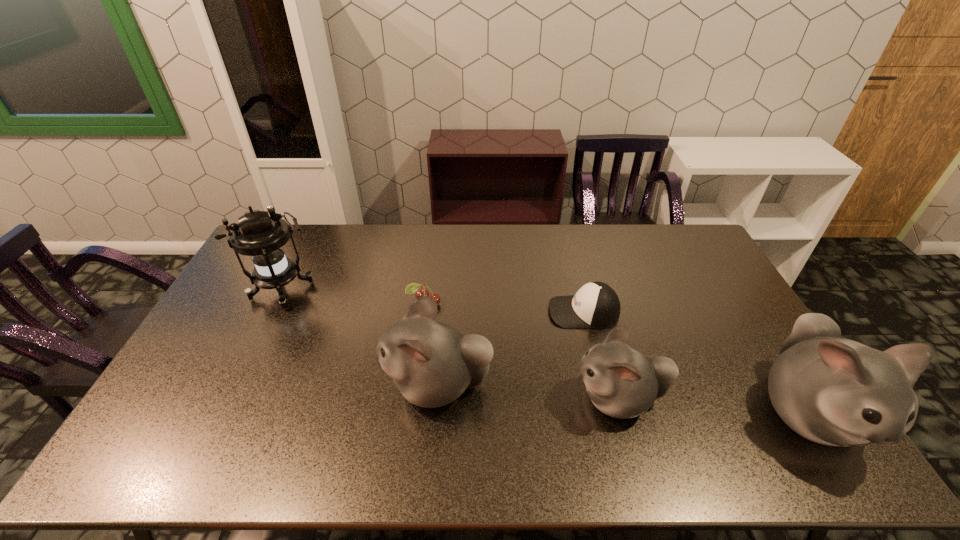
This screenshot has width=960, height=540. Identify the location of free space that is in between the third tallest object and the shortest hamster. (528, 392).

Locate an element on the screen. This screenshot has width=960, height=540. free space between the rightmost object and the leftmost object is located at coordinates (545, 352).

Where is `free space between the leftmost object and the rightmost hamster`? Image resolution: width=960 pixels, height=540 pixels. free space between the leftmost object and the rightmost hamster is located at coordinates (545, 352).

Image resolution: width=960 pixels, height=540 pixels. In order to click on object that is the fifth closest one to the third shortest object in this screenshot , I will do `click(262, 237)`.

Locate which object is the closest to the second shortest hamster. Please provide its 2D coordinates. Your answer should be formatted as a tuple, i.e. [(x, y)], where the tuple contains the x and y coordinates of a point satisfying the conditions above.

[(413, 287)]

Find the location of a particular element. hamster that is the second closest to the leftmost object is located at coordinates (622, 382).

This screenshot has height=540, width=960. In order to click on hamster object that ranks as the second closest to the rightmost object in this screenshot , I will do `click(432, 364)`.